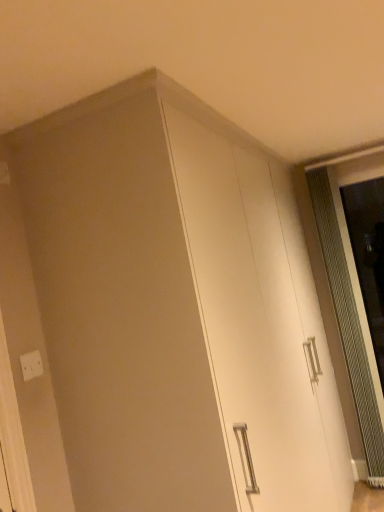
Image resolution: width=384 pixels, height=512 pixels. What do you see at coordinates (368, 254) in the screenshot? I see `clear glass screen door at right` at bounding box center [368, 254].

What are the coordinates of `white plastic electric outlet at lower left` in the screenshot? It's located at (31, 365).

The width and height of the screenshot is (384, 512). Identify the location of clear glass screen door at right. (368, 254).

Locate an element on the screen. This screenshot has width=384, height=512. electric outlet to the left of clear glass screen door at right is located at coordinates (31, 365).

How many degrees apart are the facing directions of white plastic electric outlet at lower left and clear glass screen door at right?

The angle between the facing direction of white plastic electric outlet at lower left and the facing direction of clear glass screen door at right is 89.9 degrees.

Is clear glass screen door at right completely or partially inside white plastic electric outlet at lower left?

Actually, clear glass screen door at right is outside white plastic electric outlet at lower left.

From a real-world perspective, relative to clear glass screen door at right, is white plastic electric outlet at lower left vertically above or below?

In terms of real-world spatial position, white plastic electric outlet at lower left is above clear glass screen door at right.

Who is taller, clear glass screen door at right or white glossy cabinet at center?

white glossy cabinet at center.

From a real-world perspective, is clear glass screen door at right physically below white glossy cabinet at center?

Incorrect, from a real-world perspective, clear glass screen door at right is higher than white glossy cabinet at center.

Which is further, (x=382, y=335) or (x=316, y=499)?

Positioned behind is point (x=382, y=335).

In the image, is clear glass screen door at right on the left side or the right side of white glossy cabinet at center?

clear glass screen door at right is positioned on white glossy cabinet at center's right side.

Considering the sizes of objects white glossy cabinet at center and white plastic electric outlet at lower left in the image provided, who is smaller, white glossy cabinet at center or white plastic electric outlet at lower left?

white plastic electric outlet at lower left.

Consider the image. Is white glossy cabinet at center turned away from white plastic electric outlet at lower left?

That's not correct — white glossy cabinet at center is not looking away from white plastic electric outlet at lower left.

From the image's perspective, is white glossy cabinet at center above or below white plastic electric outlet at lower left?

Clearly, from the image's perspective, white glossy cabinet at center is below white plastic electric outlet at lower left.

Which point is more forward, (176, 168) or (30, 377)?

The point (176, 168) is more forward.

Considering the relative sizes of clear glass screen door at right and white plastic electric outlet at lower left in the image provided, is clear glass screen door at right shorter than white plastic electric outlet at lower left?

No.

From a real-world perspective, between clear glass screen door at right and white plastic electric outlet at lower left, who is vertically higher?

From a 3D spatial view, white plastic electric outlet at lower left is above.

Can you tell me how much clear glass screen door at right and white plastic electric outlet at lower left differ in facing direction?

89.9 degrees separate the facing orientations of clear glass screen door at right and white plastic electric outlet at lower left.

Is point (360, 250) closer or farther from the camera than point (27, 373)?

Point (360, 250) is farther from the camera than point (27, 373).

Which of these two, white glossy cabinet at center or clear glass screen door at right, stands taller?

Standing taller between the two is white glossy cabinet at center.

From a real-world perspective, who is located lower, white glossy cabinet at center or clear glass screen door at right?

white glossy cabinet at center is physically lower.

Identify the location of cabinetry below the clear glass screen door at right (from the image's perspective). Image resolution: width=384 pixels, height=512 pixels. (261, 322).

Does white glossy cabinet at center have a larger size compared to clear glass screen door at right?

Correct, white glossy cabinet at center is larger in size than clear glass screen door at right.

What's the angular difference between white plastic electric outlet at lower left and white glossy cabinet at center's facing directions?

The facing directions of white plastic electric outlet at lower left and white glossy cabinet at center are 0.011 degrees apart.

Measure the distance between white plastic electric outlet at lower left and white glossy cabinet at center.

They are 1.08 meters apart.

Locate an element on the screen. electric outlet that appears above the white glossy cabinet at center (from the image's perspective) is located at coordinates (31, 365).

Considering the relative positions of white plastic electric outlet at lower left and white glossy cabinet at center in the image provided, is white plastic electric outlet at lower left to the right of white glossy cabinet at center from the viewer's perspective?

In fact, white plastic electric outlet at lower left is to the left of white glossy cabinet at center.

At what (x,y) coordinates should I click in order to perform the action: click on electric outlet below the clear glass screen door at right (from the image's perspective). Please return your answer as a coordinate pair (x, y). Image resolution: width=384 pixels, height=512 pixels. Looking at the image, I should click on (31, 365).

Find the location of a particular element. This screenshot has height=512, width=384. screen door above the white glossy cabinet at center (from a real-world perspective) is located at coordinates (368, 254).

Estimate the real-world distances between objects in this image. Which object is closer to white glossy cabinet at center, clear glass screen door at right or white plastic electric outlet at lower left?

clear glass screen door at right.

Estimate the real-world distances between objects in this image. Which object is further from white glossy cabinet at center, white plastic electric outlet at lower left or clear glass screen door at right?

Based on the image, white plastic electric outlet at lower left appears to be further to white glossy cabinet at center.

When comparing their distances from white plastic electric outlet at lower left, does white glossy cabinet at center or clear glass screen door at right seem closer?

white glossy cabinet at center.

Considering their positions, is white plastic electric outlet at lower left positioned closer to clear glass screen door at right than white glossy cabinet at center?

The object closer to clear glass screen door at right is white glossy cabinet at center.

When comparing their distances from clear glass screen door at right, does white glossy cabinet at center or white plastic electric outlet at lower left seem further?

The object further to clear glass screen door at right is white plastic electric outlet at lower left.

When comparing their distances from white plastic electric outlet at lower left, does clear glass screen door at right or white glossy cabinet at center seem closer?

white glossy cabinet at center lies closer to white plastic electric outlet at lower left than the other object.

This screenshot has width=384, height=512. What are the coordinates of `cabinetry located between white plastic electric outlet at lower left and clear glass screen door at right in the left-right direction` in the screenshot? It's located at (261, 322).